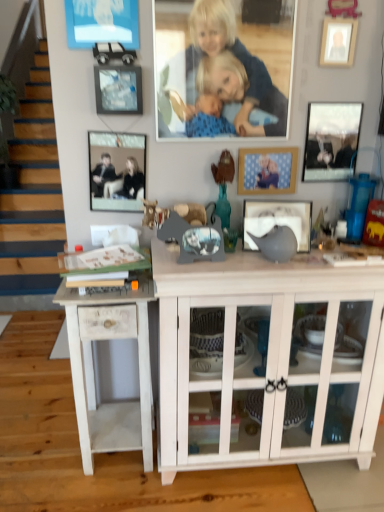
Image resolution: width=384 pixels, height=512 pixels. What do you see at coordinates (331, 141) in the screenshot?
I see `metallic silver picture frame at upper right, arranged as the 1th picture frame when viewed from the right` at bounding box center [331, 141].

Describe the element at coordinates (117, 170) in the screenshot. I see `metallic silver picture frame at upper left, the sixth picture frame from the right` at that location.

What do you see at coordinates (277, 220) in the screenshot?
I see `matte black picture frame at center, the fourth picture frame in the left-to-right sequence` at bounding box center [277, 220].

What is the approximate height of white wood cabinet at center?

white wood cabinet at center is 35.92 inches in height.

At what (x,y) coordinates should I click in order to perform the action: click on blue fabric blanket at upper center. Please return your answer as a coordinate pair (x, y). This screenshot has height=512, width=384. Looking at the image, I should click on (220, 76).

Find the location of a particular element. The height and width of the screenshot is (512, 384). wooden picture frame at upper right, which appears as the 5th picture frame when viewed from the left is located at coordinates (338, 41).

The width and height of the screenshot is (384, 512). Describe the element at coordinates (338, 41) in the screenshot. I see `wooden picture frame at upper right, which appears as the 5th picture frame when viewed from the left` at that location.

Where is `metallic silver picture frame at upper right, the sixth picture frame positioned from the left`? metallic silver picture frame at upper right, the sixth picture frame positioned from the left is located at coordinates (331, 141).

Which is behind, point (117, 75) or point (353, 55)?

Positioned behind is point (353, 55).

Is metallic silver picture frame at upper left, the 2th picture frame when ordered from left to right, to the left or to the right of wooden picture frame at upper right, which appears as the 2th picture frame when viewed from the right, in the image?

metallic silver picture frame at upper left, the 2th picture frame when ordered from left to right, is positioned on wooden picture frame at upper right, which appears as the 2th picture frame when viewed from the right,'s left side.

Is metallic silver picture frame at upper left, the 2th picture frame when ordered from left to right, not near wooden picture frame at upper right, which appears as the 5th picture frame when viewed from the left?

Actually, metallic silver picture frame at upper left, the 2th picture frame when ordered from left to right, and wooden picture frame at upper right, which appears as the 5th picture frame when viewed from the left, are a little close together.

Considering the sizes of objects metallic silver picture frame at upper left, which appears as the 5th picture frame when viewed from the right, and wooden picture frame at upper right, which appears as the 2th picture frame when viewed from the right, in the image provided, who is taller, metallic silver picture frame at upper left, which appears as the 5th picture frame when viewed from the right, or wooden picture frame at upper right, which appears as the 2th picture frame when viewed from the right,?

With more height is wooden picture frame at upper right, which appears as the 2th picture frame when viewed from the right.

Would you say white wood cabinet at center contains blue fabric picture frame at center, which is the third picture frame in left-to-right order?

No, blue fabric picture frame at center, which is the third picture frame in left-to-right order, is located outside of white wood cabinet at center.

Are white wood cabinet at center and blue fabric picture frame at center, which ranks as the 4th picture frame in right-to-left order, located far from each other?

They are positioned close to each other.

From a real-world perspective, which picture frame is the 3rd one above the white wood cabinet at center? Please provide its 2D coordinates.

[(267, 170)]

Is white wood cabinet at center facing towards blue fabric picture frame at center, which is the third picture frame in left-to-right order?

No, white wood cabinet at center is not oriented towards blue fabric picture frame at center, which is the third picture frame in left-to-right order.

In the scene shown: Does wooden picture frame at upper right, which appears as the 5th picture frame when viewed from the left, come in front of metallic silver picture frame at upper right, arranged as the 1th picture frame when viewed from the right?

Yes, wooden picture frame at upper right, which appears as the 5th picture frame when viewed from the left, is closer to the camera.

From the image's perspective, between wooden picture frame at upper right, which appears as the 5th picture frame when viewed from the left, and metallic silver picture frame at upper right, arranged as the 1th picture frame when viewed from the right, which one is located above?

From the image's view, wooden picture frame at upper right, which appears as the 5th picture frame when viewed from the left, is above.

From a real-world perspective, who is located higher, wooden picture frame at upper right, which appears as the 5th picture frame when viewed from the left, or metallic silver picture frame at upper right, the sixth picture frame positioned from the left?

wooden picture frame at upper right, which appears as the 5th picture frame when viewed from the left.

Is wooden picture frame at upper right, which appears as the 2th picture frame when viewed from the right, aimed at metallic silver picture frame at upper right, arranged as the 1th picture frame when viewed from the right?

No, wooden picture frame at upper right, which appears as the 2th picture frame when viewed from the right, is not oriented towards metallic silver picture frame at upper right, arranged as the 1th picture frame when viewed from the right.

Would you say metallic silver picture frame at upper left, the 2th picture frame when ordered from left to right, is outside metallic silver picture frame at upper right, arranged as the 1th picture frame when viewed from the right?

That's correct, metallic silver picture frame at upper left, the 2th picture frame when ordered from left to right, is outside of metallic silver picture frame at upper right, arranged as the 1th picture frame when viewed from the right.

Considering the relative positions of metallic silver picture frame at upper left, the 2th picture frame when ordered from left to right, and metallic silver picture frame at upper right, arranged as the 1th picture frame when viewed from the right, in the image provided, is metallic silver picture frame at upper left, the 2th picture frame when ordered from left to right, behind metallic silver picture frame at upper right, arranged as the 1th picture frame when viewed from the right,?

No, metallic silver picture frame at upper left, the 2th picture frame when ordered from left to right, is in front of metallic silver picture frame at upper right, arranged as the 1th picture frame when viewed from the right.

Considering the sizes of metallic silver picture frame at upper left, which appears as the 5th picture frame when viewed from the right, and metallic silver picture frame at upper right, the sixth picture frame positioned from the left, in the image, is metallic silver picture frame at upper left, which appears as the 5th picture frame when viewed from the right, bigger or smaller than metallic silver picture frame at upper right, the sixth picture frame positioned from the left,?

Clearly, metallic silver picture frame at upper left, which appears as the 5th picture frame when viewed from the right, is larger in size than metallic silver picture frame at upper right, the sixth picture frame positioned from the left.

Does metallic silver picture frame at upper left, which appears as the 5th picture frame when viewed from the right, contain matte black picture frame at center, the fourth picture frame in the left-to-right sequence?

No, matte black picture frame at center, the fourth picture frame in the left-to-right sequence, is not surrounded by metallic silver picture frame at upper left, which appears as the 5th picture frame when viewed from the right.

Is metallic silver picture frame at upper left, the 2th picture frame when ordered from left to right, with matte black picture frame at center, which appears as the 3th picture frame when viewed from the right?

No.

From the image's perspective, is metallic silver picture frame at upper left, the 2th picture frame when ordered from left to right, on matte black picture frame at center, the fourth picture frame in the left-to-right sequence?

Yes, from the image's perspective, metallic silver picture frame at upper left, the 2th picture frame when ordered from left to right, is over matte black picture frame at center, the fourth picture frame in the left-to-right sequence.

Which of these two, white wood side table at lower left or metallic silver picture frame at upper right, the sixth picture frame positioned from the left, is wider?

With larger width is white wood side table at lower left.

Between white wood side table at lower left and metallic silver picture frame at upper right, the sixth picture frame positioned from the left, which one has smaller size?

metallic silver picture frame at upper right, the sixth picture frame positioned from the left.

Which is behind, white wood side table at lower left or metallic silver picture frame at upper right, the sixth picture frame positioned from the left?

Positioned behind is metallic silver picture frame at upper right, the sixth picture frame positioned from the left.

Considering the sizes of white wood side table at lower left and metallic silver picture frame at upper right, arranged as the 1th picture frame when viewed from the right, in the image, is white wood side table at lower left taller or shorter than metallic silver picture frame at upper right, arranged as the 1th picture frame when viewed from the right,?

Clearly, white wood side table at lower left is taller compared to metallic silver picture frame at upper right, arranged as the 1th picture frame when viewed from the right.

Consider the image. Between metallic silver picture frame at upper right, arranged as the 1th picture frame when viewed from the right, and metallic silver picture frame at upper left, which ranks as the first picture frame in left-to-right order, which one has larger width?

metallic silver picture frame at upper right, arranged as the 1th picture frame when viewed from the right.

In the scene shown: Which is closer to the camera, (x=334, y=176) or (x=96, y=162)?

Point (x=334, y=176).

From the image's perspective, is metallic silver picture frame at upper right, the sixth picture frame positioned from the left, on top of metallic silver picture frame at upper left, the sixth picture frame from the right?

Indeed, from the image's perspective, metallic silver picture frame at upper right, the sixth picture frame positioned from the left, is shown above metallic silver picture frame at upper left, the sixth picture frame from the right.

Identify the location of the 3rd picture frame counting from the left side of the wooden picture frame at upper right, which appears as the 5th picture frame when viewed from the left. This screenshot has height=512, width=384. (118, 89).

At what (x,y) coordinates should I click in order to perform the action: click on cabinetry below the blue fabric picture frame at center, which ranks as the 4th picture frame in right-to-left order (from a real-world perspective). Please return your answer as a coordinate pair (x, y). This screenshot has height=512, width=384. Looking at the image, I should click on (270, 358).

Considering their positions, is wooden picture frame at upper right, which appears as the 2th picture frame when viewed from the right, positioned closer to metallic silver picture frame at upper left, which ranks as the first picture frame in left-to-right order, than blue fabric blanket at upper center?

The object closer to metallic silver picture frame at upper left, which ranks as the first picture frame in left-to-right order, is blue fabric blanket at upper center.

From the picture: Estimate the real-world distances between objects in this image. Which object is closer to metallic silver picture frame at upper right, the sixth picture frame positioned from the left, wooden picture frame at upper right, which appears as the 5th picture frame when viewed from the left, or metallic silver picture frame at upper left, which appears as the 5th picture frame when viewed from the right?

Among the two, wooden picture frame at upper right, which appears as the 5th picture frame when viewed from the left, is located nearer to metallic silver picture frame at upper right, the sixth picture frame positioned from the left.

Based on their spatial positions, is white wood side table at lower left or metallic silver picture frame at upper left, which ranks as the first picture frame in left-to-right order, closer to matte black picture frame at center, which appears as the 3th picture frame when viewed from the right?

Among the two, metallic silver picture frame at upper left, which ranks as the first picture frame in left-to-right order, is located nearer to matte black picture frame at center, which appears as the 3th picture frame when viewed from the right.

Considering their positions, is metallic silver picture frame at upper left, which ranks as the first picture frame in left-to-right order, positioned closer to matte black picture frame at center, the fourth picture frame in the left-to-right sequence, than white wood cabinet at center?

white wood cabinet at center is closer to matte black picture frame at center, the fourth picture frame in the left-to-right sequence.

Estimate the real-world distances between objects in this image. Which object is closer to wooden picture frame at upper right, which appears as the 5th picture frame when viewed from the left, white wood side table at lower left or metallic silver picture frame at upper right, the sixth picture frame positioned from the left?

Among the two, metallic silver picture frame at upper right, the sixth picture frame positioned from the left, is located nearer to wooden picture frame at upper right, which appears as the 5th picture frame when viewed from the left.

Estimate the real-world distances between objects in this image. Which object is further from matte black picture frame at center, the fourth picture frame in the left-to-right sequence, metallic silver picture frame at upper right, arranged as the 1th picture frame when viewed from the right, or metallic silver picture frame at upper left, the sixth picture frame from the right?

Among the two, metallic silver picture frame at upper left, the sixth picture frame from the right, is located further to matte black picture frame at center, the fourth picture frame in the left-to-right sequence.

Looking at the image, which one is located closer to matte black picture frame at center, the fourth picture frame in the left-to-right sequence, white wood cabinet at center or metallic silver picture frame at upper left, which appears as the 5th picture frame when viewed from the right?

white wood cabinet at center is positioned closer to the anchor matte black picture frame at center, the fourth picture frame in the left-to-right sequence.

From the picture: Considering their positions, is matte black picture frame at center, the fourth picture frame in the left-to-right sequence, positioned further to wooden picture frame at upper right, which appears as the 2th picture frame when viewed from the right, than metallic silver picture frame at upper left, the sixth picture frame from the right?

Based on the image, metallic silver picture frame at upper left, the sixth picture frame from the right, appears to be further to wooden picture frame at upper right, which appears as the 2th picture frame when viewed from the right.

Find the location of a particular element. The image size is (384, 512). picture frame located between metallic silver picture frame at upper left, the sixth picture frame from the right, and blue fabric picture frame at center, which ranks as the 4th picture frame in right-to-left order, in the left-right direction is located at coordinates (118, 89).

The width and height of the screenshot is (384, 512). What are the coordinates of `picture frame located between metallic silver picture frame at upper left, the 2th picture frame when ordered from left to right, and matte black picture frame at center, which appears as the 3th picture frame when viewed from the right, in the left-right direction` in the screenshot? It's located at (267, 170).

Identify the location of cabinetry between blue fabric picture frame at center, which ranks as the 4th picture frame in right-to-left order, and white wood side table at lower left in the up-down direction. (270, 358).

Where is `person between metallic silver picture frame at upper left, which ranks as the first picture frame in left-to-right order, and matte black picture frame at center, which appears as the 3th picture frame when viewed from the right, from left to right`? This screenshot has height=512, width=384. person between metallic silver picture frame at upper left, which ranks as the first picture frame in left-to-right order, and matte black picture frame at center, which appears as the 3th picture frame when viewed from the right, from left to right is located at coordinates (220, 76).